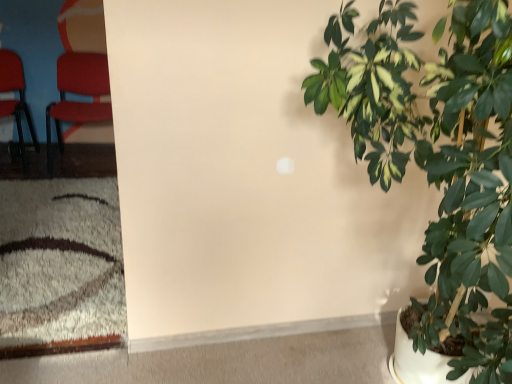
Question: Is white matte carpet at lower left to the right of matte red chair at left, the first chair when ordered from right to left, from the viewer's perspective?

Choices:
 (A) yes
 (B) no

Answer: (A)

Question: Is white matte carpet at lower left outside matte red chair at left, the first chair when ordered from right to left?

Choices:
 (A) yes
 (B) no

Answer: (A)

Question: Is matte red chair at left, the first chair when ordered from right to left, at the back of white matte carpet at lower left?

Choices:
 (A) yes
 (B) no

Answer: (B)

Question: From the image's perspective, is white matte carpet at lower left above matte red chair at left, the 2th chair from the left?

Choices:
 (A) yes
 (B) no

Answer: (B)

Question: Is white matte carpet at lower left thinner than matte red chair at left, the first chair when ordered from right to left?

Choices:
 (A) no
 (B) yes

Answer: (A)

Question: From the image's perspective, is white matte carpet at lower left beneath matte red chair at left, the first chair when ordered from right to left?

Choices:
 (A) no
 (B) yes

Answer: (B)

Question: Is the depth of matte red chair at left, which ranks as the first chair in left-to-right order, greater than that of matte red chair at left, the 2th chair from the left?

Choices:
 (A) no
 (B) yes

Answer: (A)

Question: Would you say matte red chair at left, the first chair when ordered from right to left, is part of matte red chair at left, marked as the 2th chair in a right-to-left arrangement,'s contents?

Choices:
 (A) yes
 (B) no

Answer: (B)

Question: Does matte red chair at left, marked as the 2th chair in a right-to-left arrangement, appear on the right side of matte red chair at left, the first chair when ordered from right to left?

Choices:
 (A) no
 (B) yes

Answer: (A)

Question: Can you confirm if matte red chair at left, marked as the 2th chair in a right-to-left arrangement, is bigger than matte red chair at left, the 2th chair from the left?

Choices:
 (A) yes
 (B) no

Answer: (B)

Question: Is matte red chair at left, marked as the 2th chair in a right-to-left arrangement, shorter than matte red chair at left, the 2th chair from the left?

Choices:
 (A) yes
 (B) no

Answer: (B)

Question: Is matte red chair at left, marked as the 2th chair in a right-to-left arrangement, wider than matte red chair at left, the 2th chair from the left?

Choices:
 (A) no
 (B) yes

Answer: (B)

Question: From the image's perspective, is white matte carpet at lower left beneath matte red chair at left, which ranks as the first chair in left-to-right order?

Choices:
 (A) yes
 (B) no

Answer: (A)